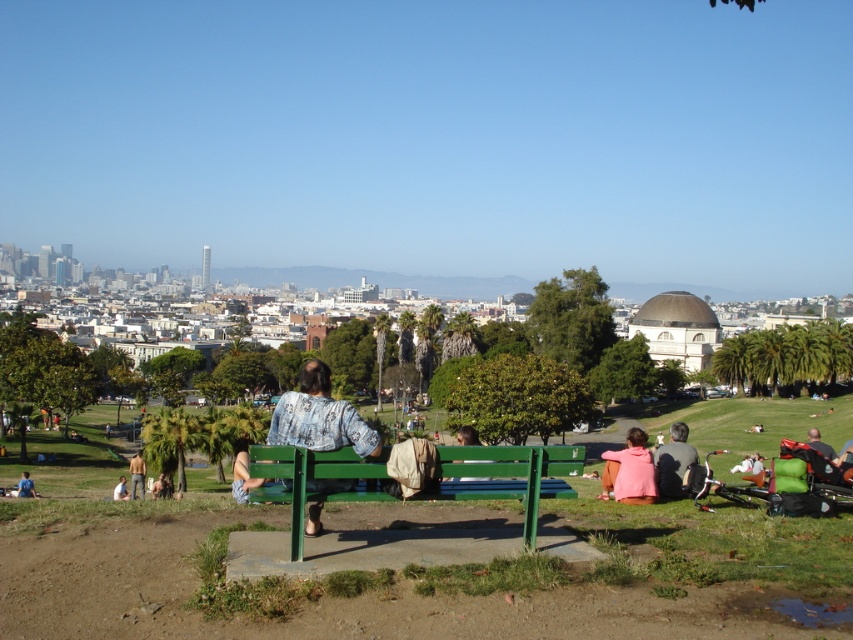
Who is more distant from viewer, (508, 472) or (167, 493)?

Positioned behind is point (167, 493).

Which is above, green painted wood bench at center or light brown fabric shirt at lower left?

green painted wood bench at center

Between point (491, 454) and point (167, 481), which one is positioned in front?

Point (491, 454) is more forward.

Identify the location of green painted wood bench at center. The width and height of the screenshot is (853, 640). (511, 477).

Does pink fleece jacket at lower right have a smaller size compared to light brown fabric shirt at lower left?

No, pink fleece jacket at lower right is not smaller than light brown fabric shirt at lower left.

Which is more to the left, pink fleece jacket at lower right or light brown fabric shirt at lower left?

From the viewer's perspective, light brown fabric shirt at lower left appears more on the left side.

Is point (636, 428) in front of point (164, 488)?

No, (636, 428) is behind (164, 488).

Identify the location of pink fleece jacket at lower right. This screenshot has width=853, height=640. (630, 472).

What do you see at coordinates (672, 461) in the screenshot?
I see `dark gray sweater at lower right` at bounding box center [672, 461].

You are a GUI agent. You are given a task and a screenshot of the screen. Output one action in this format:
    pyautogui.click(x=<x>, y=<y>)
    Task: Click on the dark gray sweater at lower right
    The image size is (853, 640).
    Given the screenshot: What is the action you would take?
    pyautogui.click(x=672, y=461)